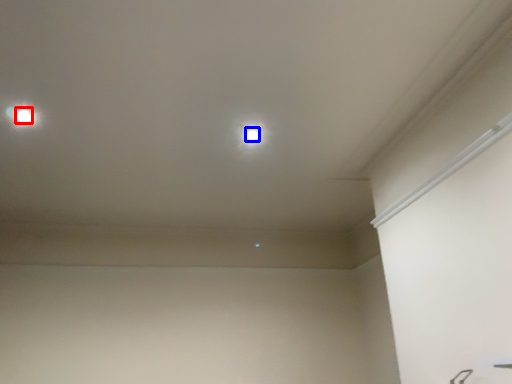
Question: Which of the following is the farthest to the observer, dot (highlighted by a red box) or dot (highlighted by a blue box)?

Choices:
 (A) dot
 (B) dot

Answer: (B)